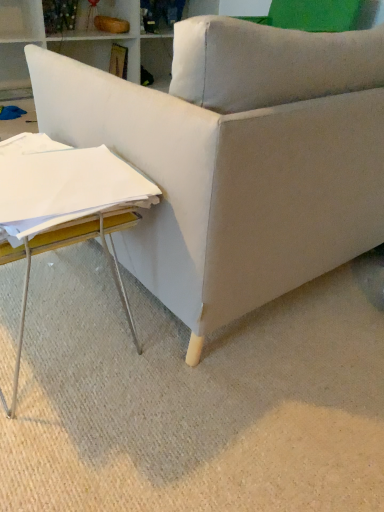
Question: Is white wood table at lower left outside white paper at lower left?

Choices:
 (A) no
 (B) yes

Answer: (B)

Question: From the image's perspective, is white wood table at lower left located above white paper at lower left?

Choices:
 (A) no
 (B) yes

Answer: (A)

Question: Is white wood table at lower left at the left side of white paper at lower left?

Choices:
 (A) no
 (B) yes

Answer: (B)

Question: Is white wood table at lower left not close to white paper at lower left?

Choices:
 (A) no
 (B) yes

Answer: (A)

Question: Does white wood table at lower left have a lesser height compared to white paper at lower left?

Choices:
 (A) no
 (B) yes

Answer: (A)

Question: Is point (11, 150) closer or farther from the camera than point (150, 288)?

Choices:
 (A) closer
 (B) farther

Answer: (A)

Question: Visually, is white paper at lower left positioned to the left or to the right of beige fabric couch at lower right?

Choices:
 (A) left
 (B) right

Answer: (A)

Question: Is white paper at lower left in front of or behind beige fabric couch at lower right in the image?

Choices:
 (A) behind
 (B) front

Answer: (A)

Question: In terms of height, does white paper at lower left look taller or shorter compared to beige fabric couch at lower right?

Choices:
 (A) tall
 (B) short

Answer: (A)

Question: Considering the positions of white wood table at lower left and white paper at lower left in the image, is white wood table at lower left taller or shorter than white paper at lower left?

Choices:
 (A) tall
 (B) short

Answer: (A)

Question: From a real-world perspective, is white wood table at lower left physically located above or below white paper at lower left?

Choices:
 (A) below
 (B) above

Answer: (A)

Question: Is white wood table at lower left wider or thinner than white paper at lower left?

Choices:
 (A) thin
 (B) wide

Answer: (B)

Question: Based on their positions, is white wood table at lower left located to the left or right of white paper at lower left?

Choices:
 (A) left
 (B) right

Answer: (A)

Question: Is white wood table at lower left inside or outside of beige fabric couch at lower right?

Choices:
 (A) inside
 (B) outside

Answer: (B)

Question: Looking at their shapes, would you say white wood table at lower left is wider or thinner than beige fabric couch at lower right?

Choices:
 (A) wide
 (B) thin

Answer: (B)